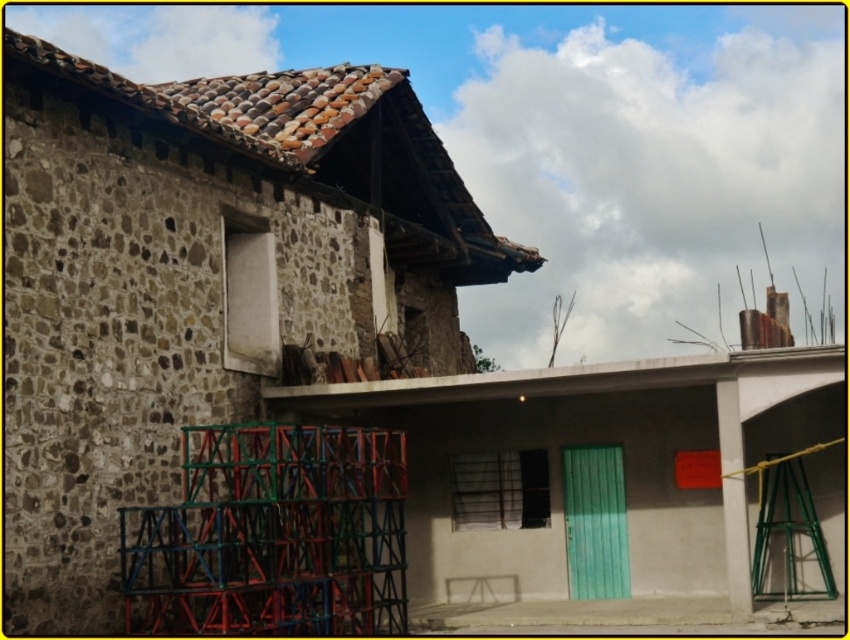
You are standing in the middle of the scene and want to take a photo of both the brown stone wall at left and the metallic scaffolding at left. Which object should you focus on first to ensure both are in clear view?

You should focus on the brown stone wall at left first because it is closer to the viewer than the metallic scaffolding at left, so adjusting focus from near to far will help capture both clearly.